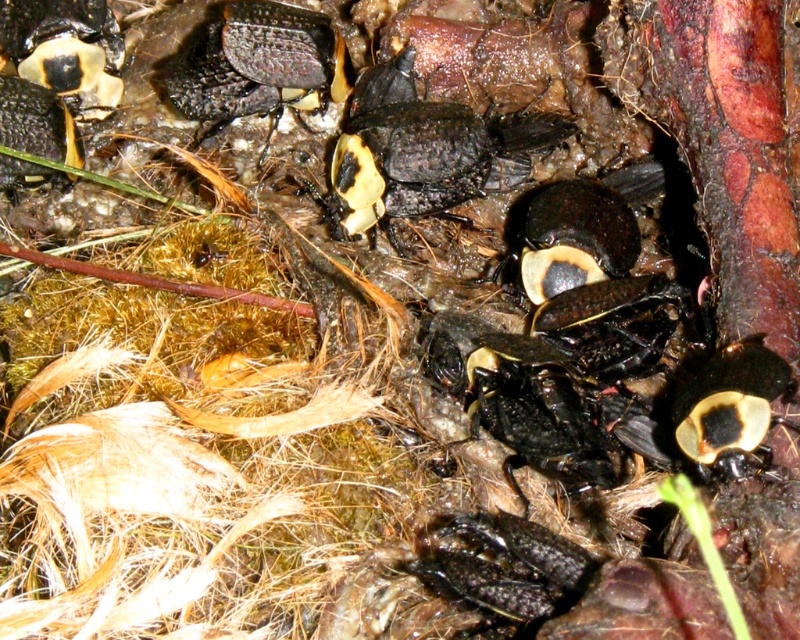
Based on the photo, you are an entomologist observing the beetles. You notice that the matte black beetle at center and the shiny black beetle at upper center are positioned in a way that affects your visibility. Which beetle is closer to you, making it easier to observe its distinctive yellow markings?

The matte black beetle at center is closer to you, so it is easier to observe its distinctive yellow markings compared to the shiny black beetle at upper center.

You are an entomologist observing the beetles in the scene. You notice two beetles of interest. The matte black beetle at center and the shiny black beetle at upper center. Which beetle is bigger?

The matte black beetle at center is larger than the shiny black beetle at upper center.